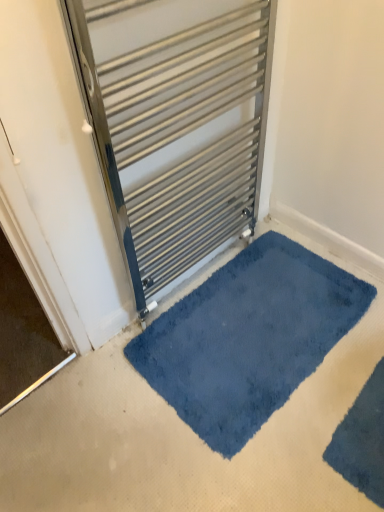
This screenshot has width=384, height=512. Identify the location of free space above velvety blue bath mat at lower right, positioned as the 2th bath mat in back-to-front order (from a real-world perspective). (369, 435).